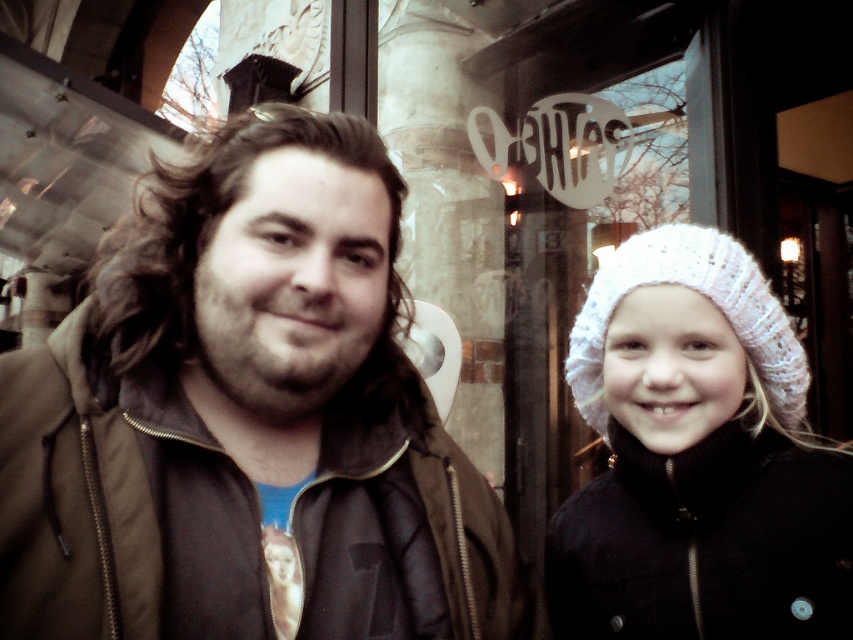
Question: Which point is farther to the camera?

Choices:
 (A) white knitted hat at right
 (B) white knitted beret at upper right
 (C) brown matte jacket at center

Answer: (A)

Question: Which point is closer to the camera?

Choices:
 (A) white knitted hat at right
 (B) brown matte jacket at center
 (C) white knitted beret at upper right

Answer: (B)

Question: Can you confirm if white knitted beret at upper right is thinner than white knitted hat at right?

Choices:
 (A) no
 (B) yes

Answer: (A)

Question: In this image, where is white knitted beret at upper right located relative to white knitted hat at right?

Choices:
 (A) left
 (B) right

Answer: (B)

Question: From the image, what is the correct spatial relationship of white knitted beret at upper right in relation to white knitted hat at right?

Choices:
 (A) right
 (B) left

Answer: (A)

Question: Which object is the farthest from the white knitted hat at right?

Choices:
 (A) brown matte jacket at center
 (B) white knitted beret at upper right

Answer: (A)